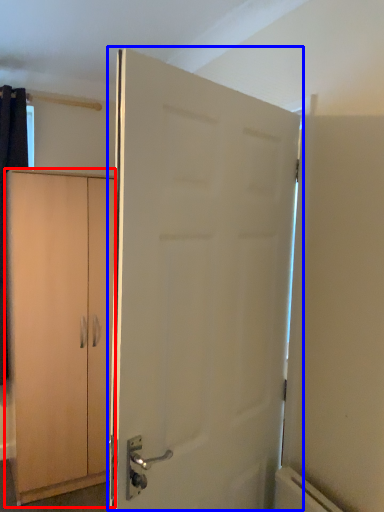
Question: Which of the following is the farthest to the observer, cabinetry (highlighted by a red box) or door (highlighted by a blue box)?

Choices:
 (A) cabinetry
 (B) door

Answer: (A)